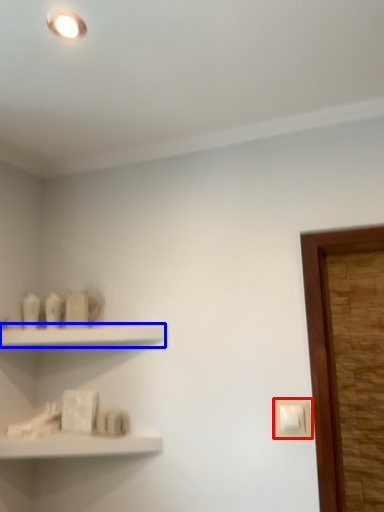
Question: Which object appears farthest to the camera in this image, light switch (highlighted by a red box) or shelf (highlighted by a blue box)?

Choices:
 (A) light switch
 (B) shelf

Answer: (B)